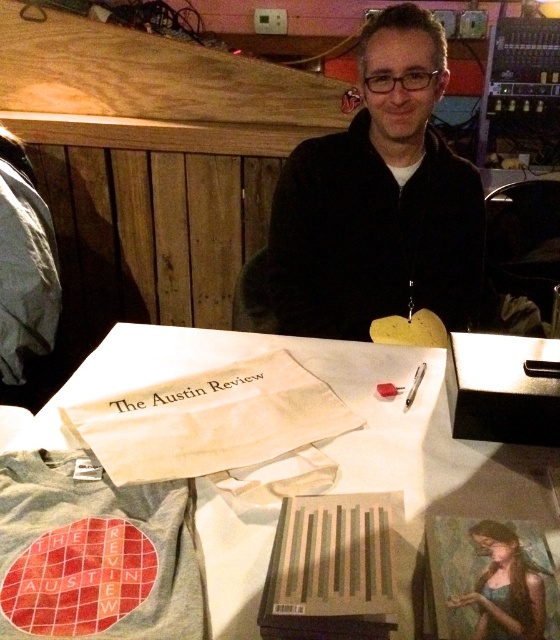
Question: Is black matte jacket at center further to camera compared to white cloth bag at center?

Choices:
 (A) yes
 (B) no

Answer: (A)

Question: Which point appears closest to the camera in this image?

Choices:
 (A) coord(342,300)
 (B) coord(152,410)

Answer: (B)

Question: Can you confirm if black matte jacket at center is smaller than white cloth bag at center?

Choices:
 (A) no
 (B) yes

Answer: (A)

Question: Which point is farther from the camera taking this photo?

Choices:
 (A) (309, 147)
 (B) (478, 627)
 (C) (50, 433)

Answer: (A)

Question: Which of the following is the closest to the observer?

Choices:
 (A) black matte jacket at center
 (B) oil painting of woman at center

Answer: (B)

Question: Does black matte jacket at center have a smaller size compared to white cloth bag at center?

Choices:
 (A) no
 (B) yes

Answer: (A)